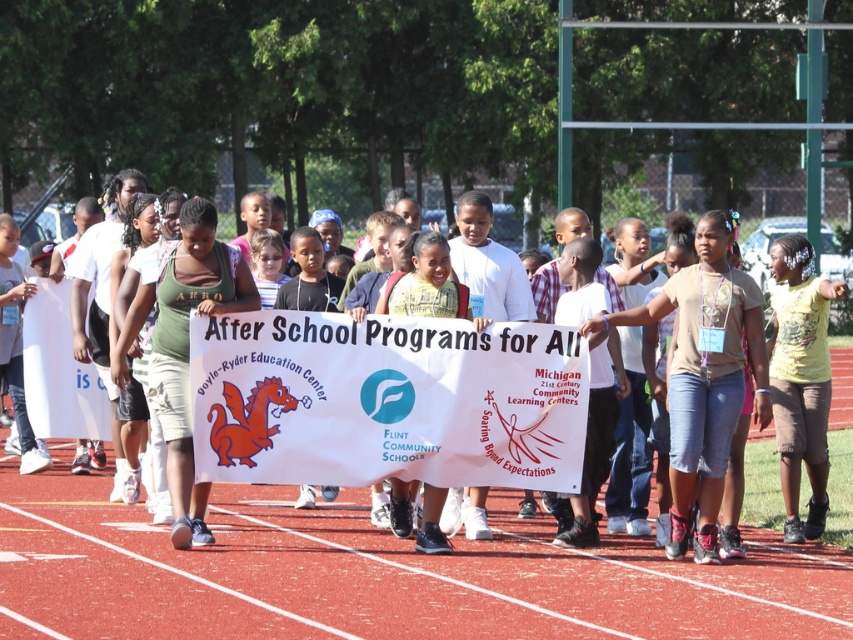
Between red rubber track at center and yellow t-shirt at center, which one appears on the right side from the viewer's perspective?

From the viewer's perspective, yellow t-shirt at center appears more on the right side.

Which of these two, red rubber track at center or yellow t-shirt at center, stands shorter?

With less height is red rubber track at center.

You are a GUI agent. You are given a task and a screenshot of the screen. Output one action in this format:
    pyautogui.click(x=<x>, y=<y>)
    Task: Click on the red rubber track at center
    
    Given the screenshot: What is the action you would take?
    pyautogui.click(x=373, y=577)

Which is more to the left, yellow t-shirt at center or white paper sign at center?

From the viewer's perspective, white paper sign at center appears more on the left side.

Can you confirm if yellow t-shirt at center is positioned below white paper sign at center?

Yes.

Between point (814, 518) and point (627, 227), which one is positioned behind?

Positioned behind is point (627, 227).

You are a GUI agent. You are given a task and a screenshot of the screen. Output one action in this format:
    pyautogui.click(x=<x>, y=<y>)
    Task: Click on the yellow t-shirt at center
    The image size is (853, 640).
    Given the screenshot: What is the action you would take?
    pyautogui.click(x=799, y=380)

Can you confirm if red rubber track at center is positioned below white paper sign at center?

Yes.

Does point (135, 634) lie behind point (576, 228)?

No, (135, 634) is in front of (576, 228).

The width and height of the screenshot is (853, 640). Find the location of `red rubber track at center`. red rubber track at center is located at coordinates (373, 577).